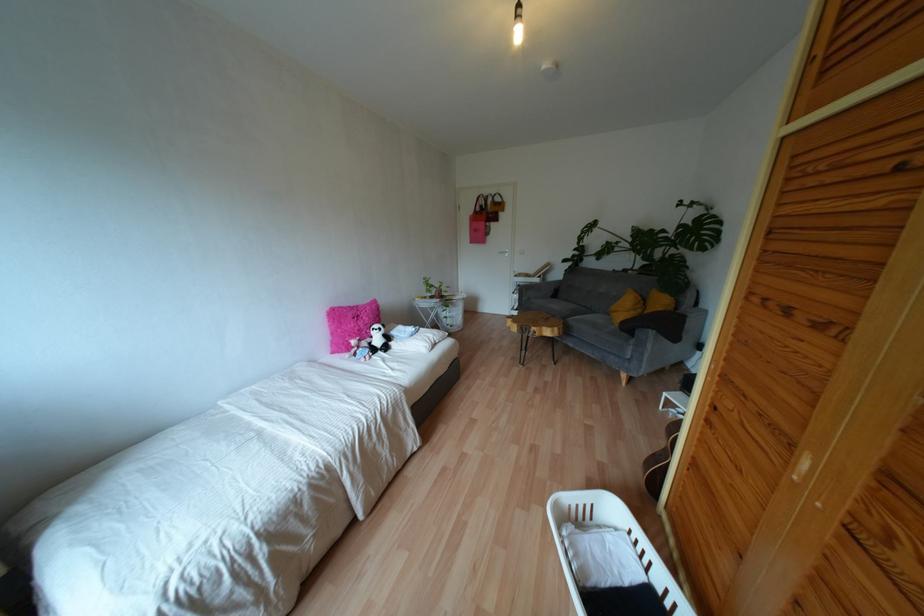
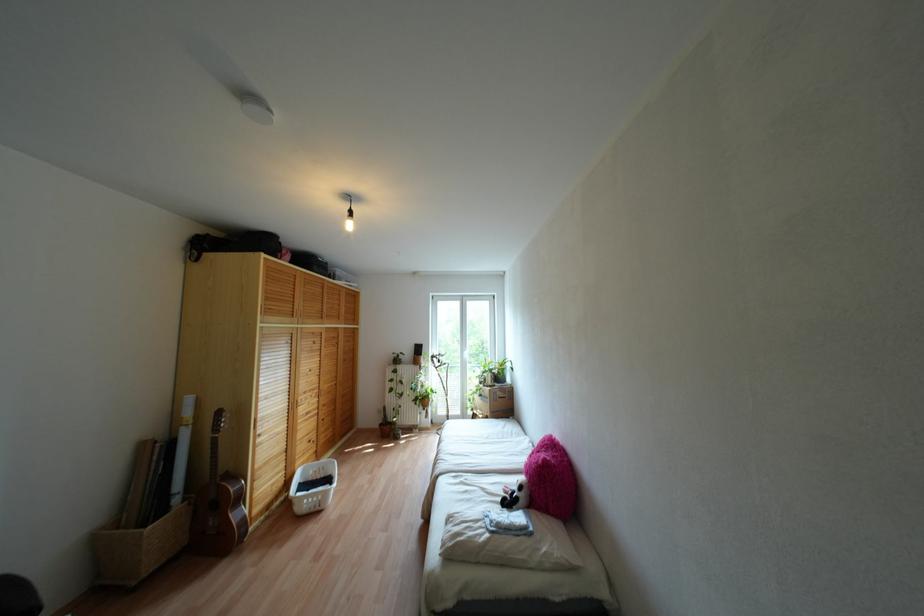
Question: I am providing you with two images of the same scene from different viewpoints. After the viewpoint changes to image2, which objects are now occluded?

Choices:
 (A) white pillow
 (B) panda stuffed animal
 (C) black bag
 (D) red electronic box

Answer: (B)